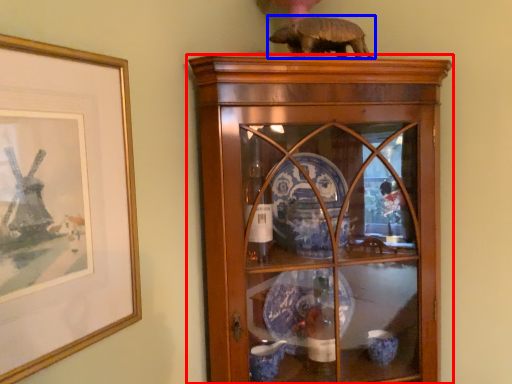
Question: Which object appears farthest to the camera in this image, shelf (highlighted by a red box) or animal (highlighted by a blue box)?

Choices:
 (A) shelf
 (B) animal

Answer: (B)